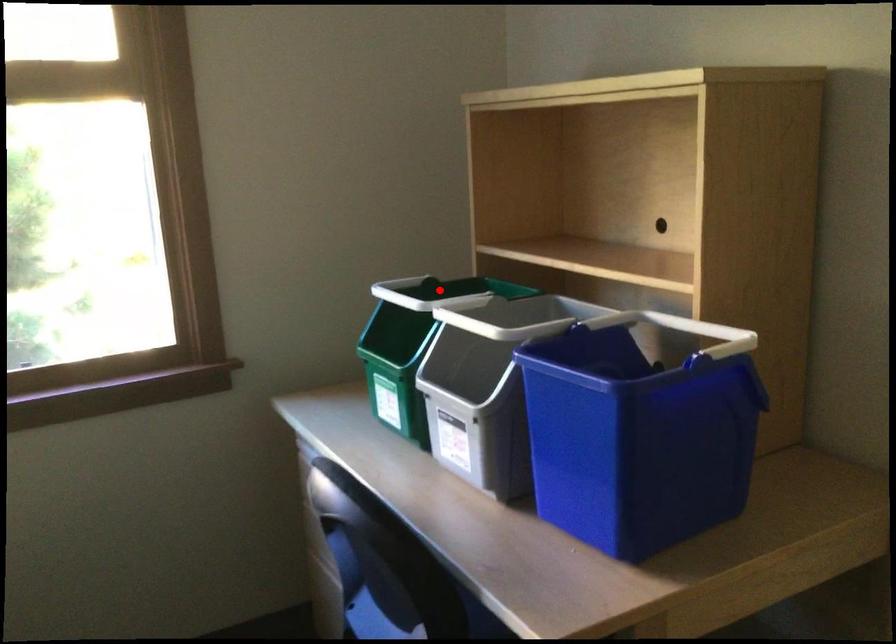
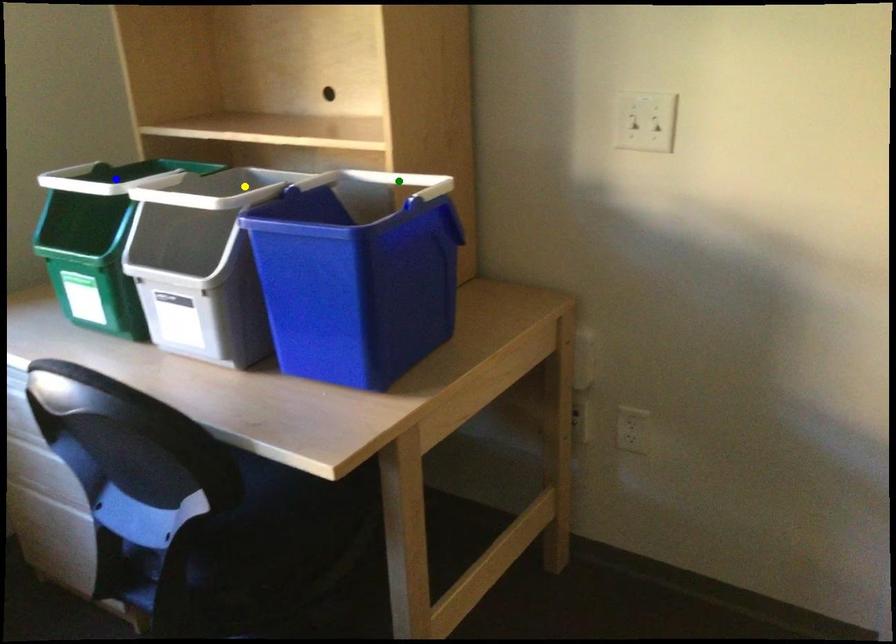
Question: I am providing you with two images of the same scene from different viewpoints. A red point is marked on the first image. You are given multiple points on the second image. Which point in image 2 is actually the same real-world point as the red point in image 1?

Choices:
 (A) green point
 (B) blue point
 (C) yellow point

Answer: (B)